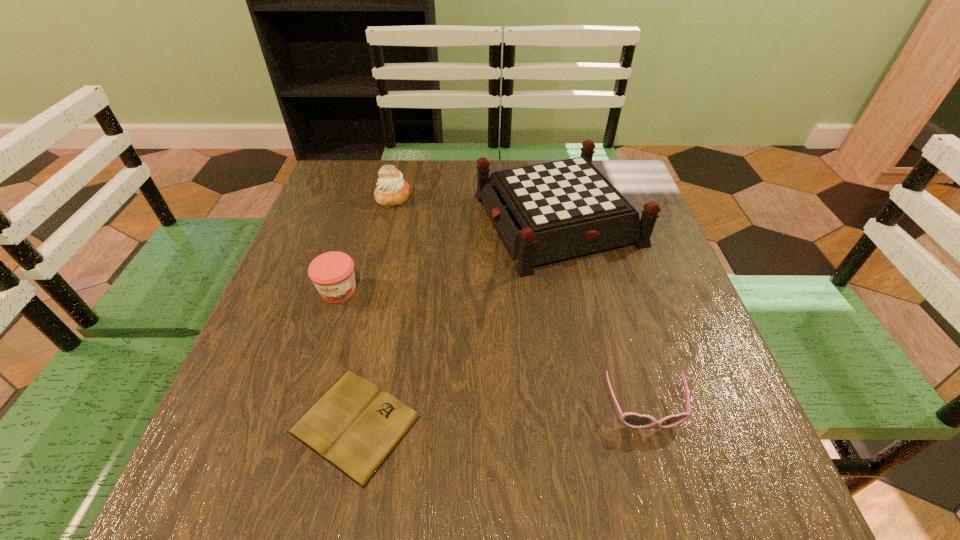
The width and height of the screenshot is (960, 540). In order to click on the tallest object in this screenshot , I will do `click(546, 212)`.

Locate an element on the screen. pastry is located at coordinates (392, 190).

Where is `the third tallest object`? the third tallest object is located at coordinates pos(332,273).

Image resolution: width=960 pixels, height=540 pixels. Identify the location of the fourth tallest object. (631, 419).

Identify the location of the shortest object. Image resolution: width=960 pixels, height=540 pixels. (355, 426).

The width and height of the screenshot is (960, 540). Identify the location of blank space located on the left of the checkerboard. (422, 219).

Where is `vacant space located 0.050m on the right of the pastry`? This screenshot has height=540, width=960. vacant space located 0.050m on the right of the pastry is located at coordinates (430, 197).

Find the location of a particular element. This screenshot has height=540, width=960. vacant space situated on the front label of the jam is located at coordinates (303, 403).

At what (x,y) coordinates should I click in order to perform the action: click on vacant region located on the front-facing side of the sunglasses. Please return your answer as a coordinate pair (x, y). This screenshot has height=540, width=960. Looking at the image, I should click on (671, 498).

The width and height of the screenshot is (960, 540). In order to click on free space located 0.380m on the right of the book in this screenshot , I will do `click(650, 423)`.